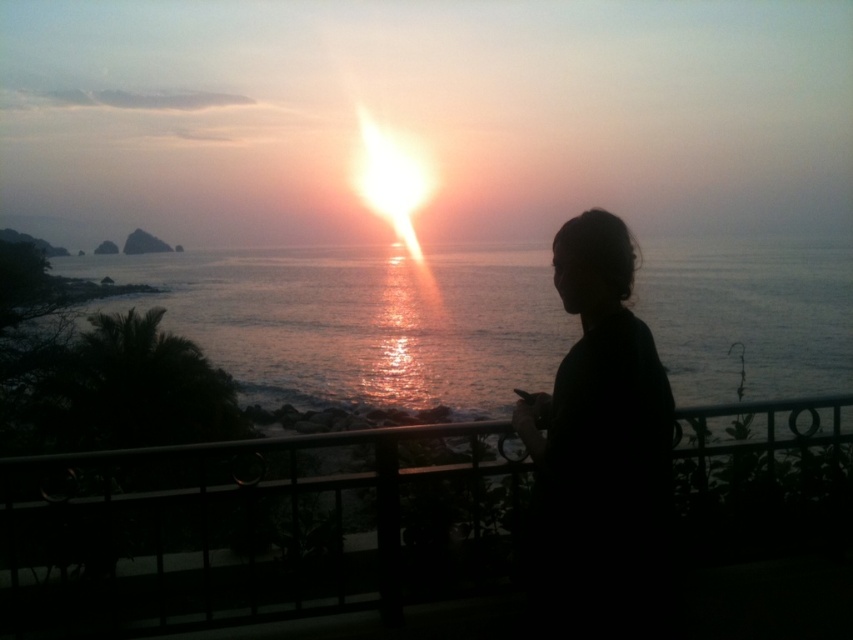
Can you confirm if black metal railing at center is positioned below black matte hair at center?

Yes, black metal railing at center is below black matte hair at center.

Which is above, black metal railing at center or black matte hair at center?

Positioned higher is black matte hair at center.

Find the location of a particular element. black metal railing at center is located at coordinates (264, 529).